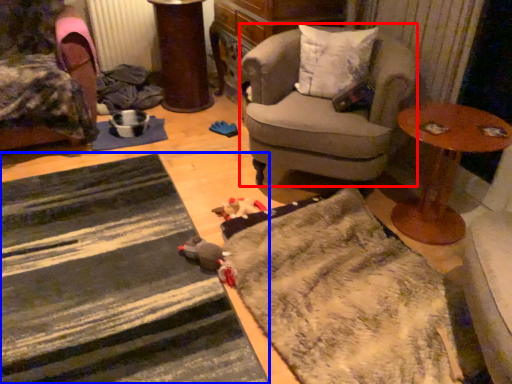
Question: Which object appears farthest to the camera in this image, chair (highlighted by a red box) or doormat (highlighted by a blue box)?

Choices:
 (A) chair
 (B) doormat

Answer: (A)